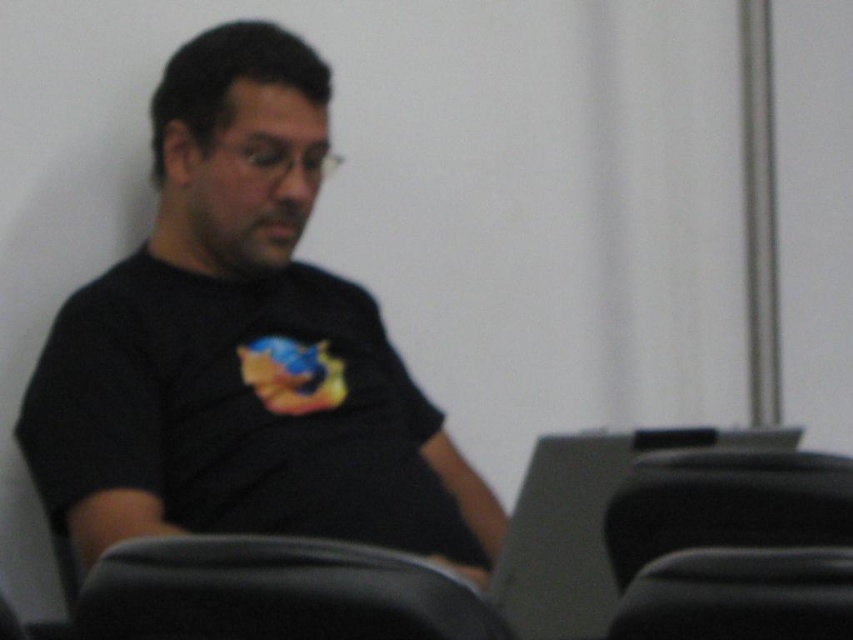
In the scene shown: You are trying to decide between two chairs in the room to sit on. The black plastic swivel chair at lower right and the black leather chair at lower right. Which one has a larger size?

The black plastic swivel chair at lower right is bigger than the black leather chair at lower right, so the black plastic swivel chair at lower right is the larger one.